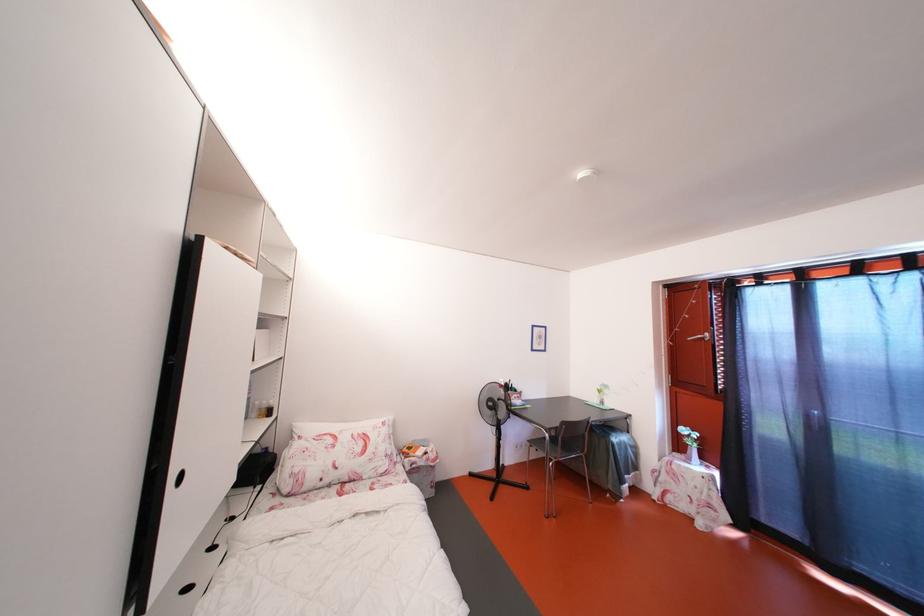
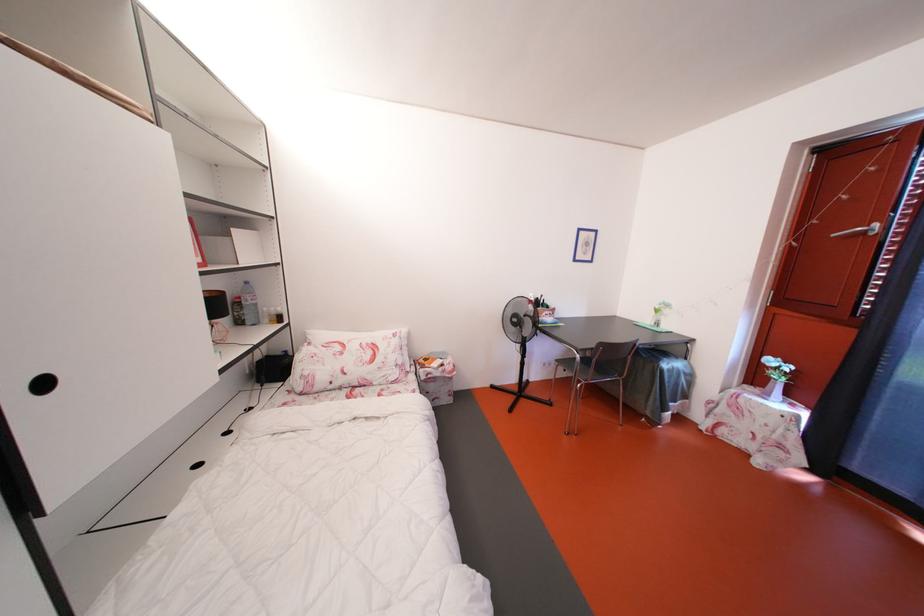
In the second image, find the point that corresponds to point (509, 390) in the first image.

(540, 305)